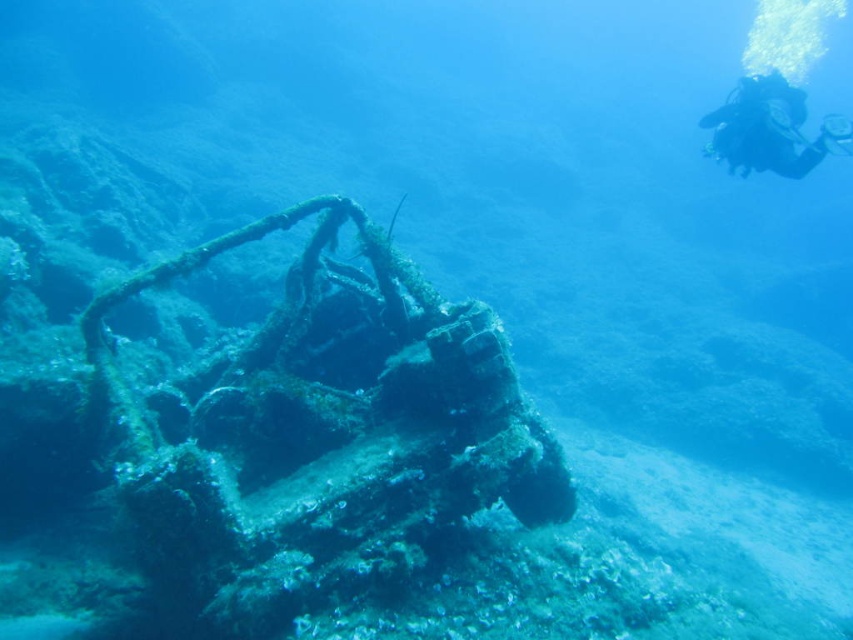
Question: Where is rusty metal shipwreck at center located in relation to black scuba diver at upper right in the image?

Choices:
 (A) right
 (B) left

Answer: (B)

Question: Which point is closer to the camera?

Choices:
 (A) (780, 100)
 (B) (457, 448)

Answer: (B)

Question: Does rusty metal shipwreck at center appear on the left side of black scuba diver at upper right?

Choices:
 (A) yes
 (B) no

Answer: (A)

Question: Which point is farther to the camera?

Choices:
 (A) (775, 132)
 (B) (281, 451)

Answer: (A)

Question: Does rusty metal shipwreck at center have a greater width compared to black scuba diver at upper right?

Choices:
 (A) no
 (B) yes

Answer: (A)